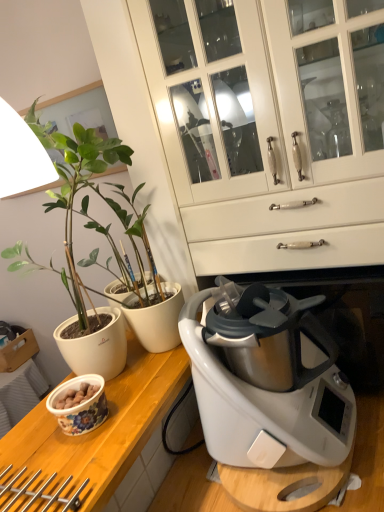
Find the location of a particular element. vacant area on top of floral ceramic bowl at lower left (from a real-world perspective) is located at coordinates (67, 443).